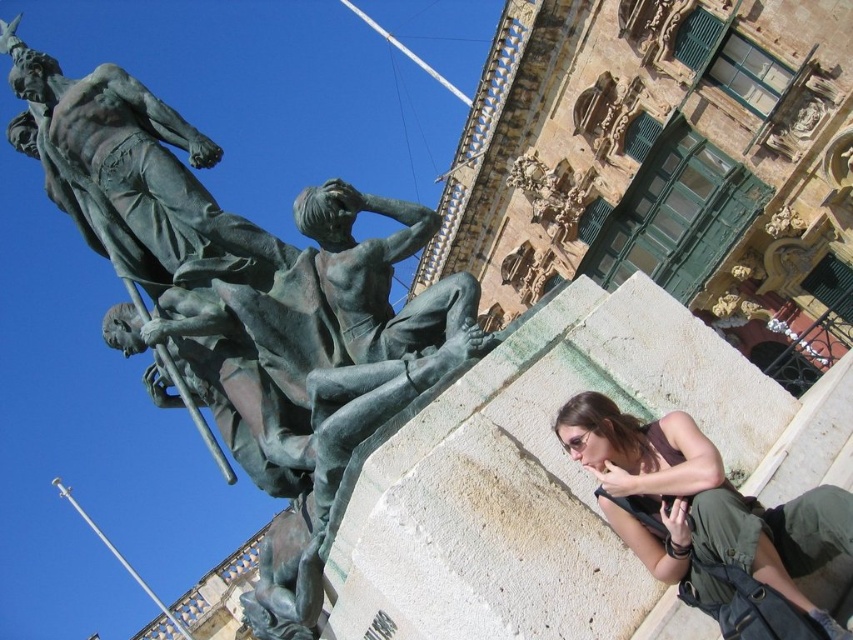
Question: Which object is farther from the camera taking this photo?

Choices:
 (A) bronze statue at center
 (B) bronze statue at upper left
 (C) matte brown hair at lower right

Answer: (B)

Question: Does bronze statue at upper left have a lesser width compared to matte brown hair at lower right?

Choices:
 (A) no
 (B) yes

Answer: (A)

Question: Which point is closer to the camera taking this photo?

Choices:
 (A) (241, 307)
 (B) (38, 70)
 (C) (312, 218)

Answer: (A)

Question: Does bronze statue at center lie behind matte brown hair at lower right?

Choices:
 (A) no
 (B) yes

Answer: (B)

Question: Among these objects, which one is farthest from the camera?

Choices:
 (A) bronze statue at center
 (B) green patina statue at upper left
 (C) matte brown hair at lower right
 (D) bronze statue at upper left

Answer: (B)

Question: Does bronze statue at center have a larger size compared to green patina statue at upper left?

Choices:
 (A) yes
 (B) no

Answer: (B)